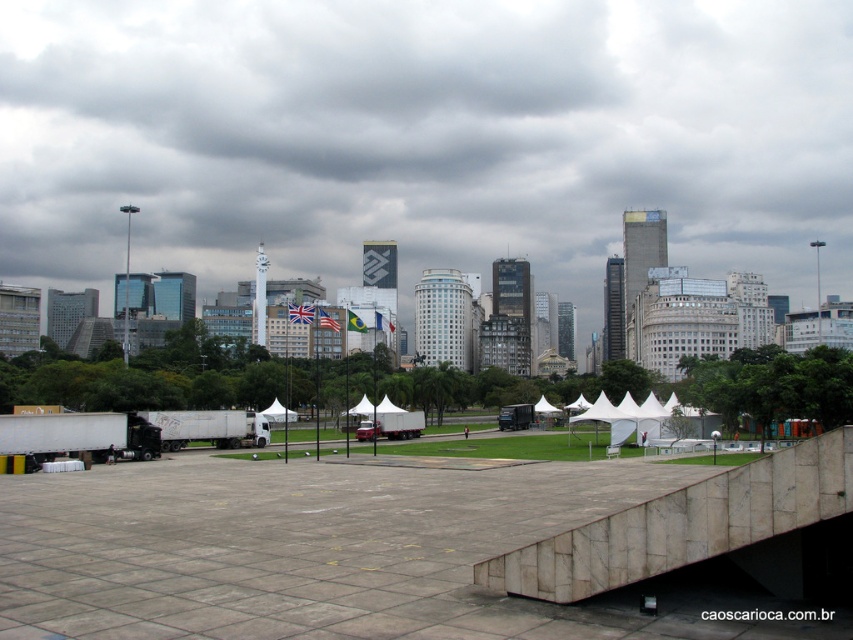
Does white canvas tent at center have a larger size compared to white fabric tent at center?

Indeed, white canvas tent at center has a larger size compared to white fabric tent at center.

Is white canvas tent at center taller than white fabric tent at center?

Yes, white canvas tent at center is taller than white fabric tent at center.

Between point (419, 435) and point (274, 403), which one is positioned in front?

Positioned in front is point (419, 435).

You are a GUI agent. You are given a task and a screenshot of the screen. Output one action in this format:
    pyautogui.click(x=<x>, y=<y>)
    Task: Click on the white canvas tent at center
    Image resolution: width=853 pixels, height=640 pixels.
    Given the screenshot: What is the action you would take?
    pyautogui.click(x=389, y=422)

Between point (260, 81) and point (287, 413), which one is positioned behind?

The point (260, 81) is more distant.

Between point (320, 20) and point (267, 406), which one is positioned in front?

Point (267, 406) is more forward.

Where is `gray cloudy sky at upper center`? This screenshot has height=640, width=853. gray cloudy sky at upper center is located at coordinates click(424, 138).

How far apart are gray cloudy sky at upper center and white marble ramp at lower center?

1430.06 feet

Looking at this image, is gray cloudy sky at upper center positioned in front of white marble ramp at lower center?

No.

Which is behind, point (517, 49) or point (819, 440)?

The point (517, 49) is behind.

Locate an element on the screen. This screenshot has width=853, height=640. gray cloudy sky at upper center is located at coordinates (424, 138).